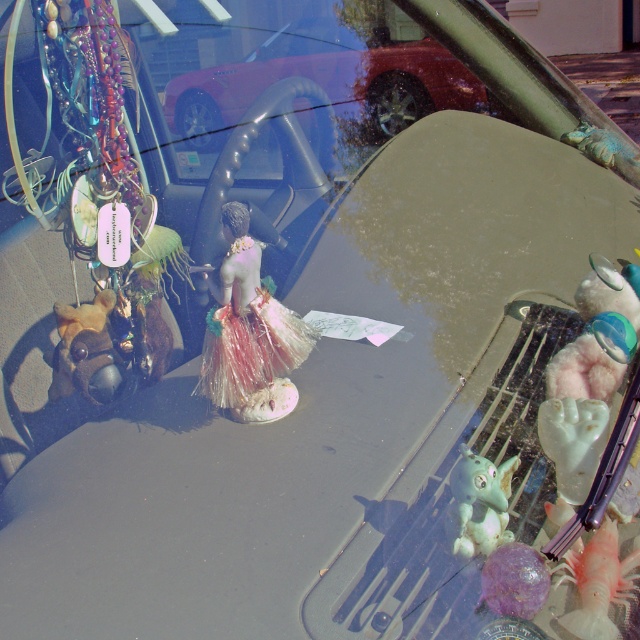
Is metallic red car at center to the left of shiny metallic figurine at center from the viewer's perspective?

In fact, metallic red car at center is to the right of shiny metallic figurine at center.

Is point (177, 80) behind point (260, 406)?

That is True.

Who is more distant from viewer, (188, 125) or (208, 394)?

Positioned behind is point (188, 125).

Where is `metallic red car at center`? The image size is (640, 640). metallic red car at center is located at coordinates (324, 81).

From the picture: Does metallic red car at center appear on the right side of green rubber toy at lower right?

In fact, metallic red car at center is to the left of green rubber toy at lower right.

Is metallic red car at center wider than green rubber toy at lower right?

Correct, the width of metallic red car at center exceeds that of green rubber toy at lower right.

Is point (483, 92) in front of point (490, 516)?

No.

Locate an element on the screen. metallic red car at center is located at coordinates (324, 81).

At what (x,y) coordinates should I click in order to perform the action: click on shiny metallic figurine at center. Please return your answer as a coordinate pair (x, y). The width and height of the screenshot is (640, 640). Looking at the image, I should click on (248, 332).

Between shiny metallic figurine at center and green rubber toy at lower right, which one is positioned higher?

shiny metallic figurine at center is higher up.

Between point (228, 337) and point (490, 486), which one is positioned in front?

Positioned in front is point (490, 486).

The height and width of the screenshot is (640, 640). In order to click on shiny metallic figurine at center in this screenshot , I will do `click(248, 332)`.